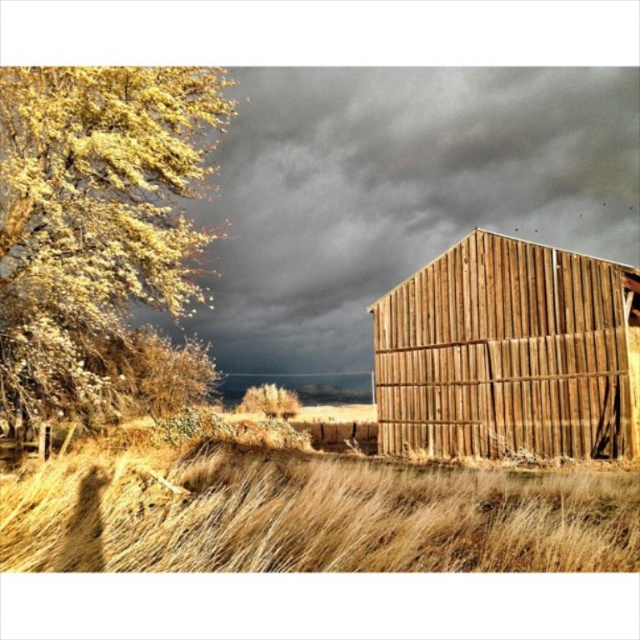
Question: Which point appears farthest from the camera in this image?

Choices:
 (A) (262, 522)
 (B) (324, 145)
 (C) (99, 276)

Answer: (B)

Question: In this image, where is dark gray textured sky at upper center located relative to wooden barn at right?

Choices:
 (A) right
 (B) left

Answer: (B)

Question: Where is golden textured leaves at left located in relation to dry straw at center in the image?

Choices:
 (A) below
 (B) above

Answer: (B)

Question: Which object is positioned closest to the golden textured tree at center?

Choices:
 (A) dry straw at center
 (B) wooden barn at right
 (C) dark gray textured sky at upper center

Answer: (C)

Question: Is dry straw at center above golden textured tree at center?

Choices:
 (A) yes
 (B) no

Answer: (A)

Question: Among these objects, which one is farthest from the camera?

Choices:
 (A) golden textured tree at center
 (B) golden textured leaves at left
 (C) dry straw at center

Answer: (A)